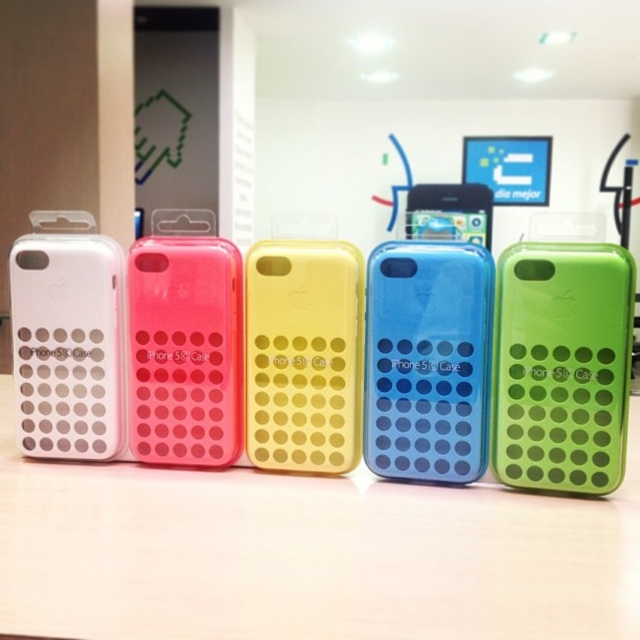
You are organizing a display of phone cases and need to place a new case between the green matte iphone case at center and the matte white phone case at left. The new case is 10 inches wide. Is there enough space between them to fit the new case?

The distance between the green matte iphone case at center and the matte white phone case at left is 19.69 inches. Since the new case is 10 inches wide, there is sufficient space to place it between them.

You are trying to choose between the blue translucent phone case at center and the pink matte iphone case at center. Which one is bigger?

The pink matte iphone case at center is bigger than the blue translucent phone case at center.